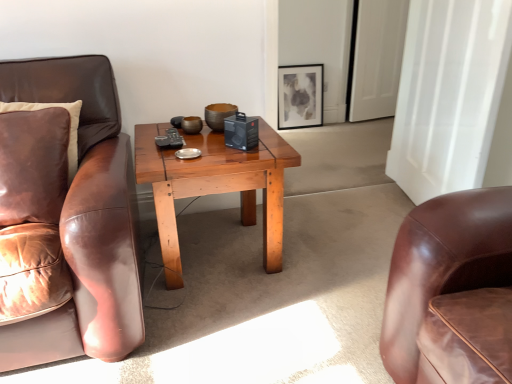
Find the location of a particular element. vacant area located to the right-hand side of matte black picture frame at upper center is located at coordinates (332, 132).